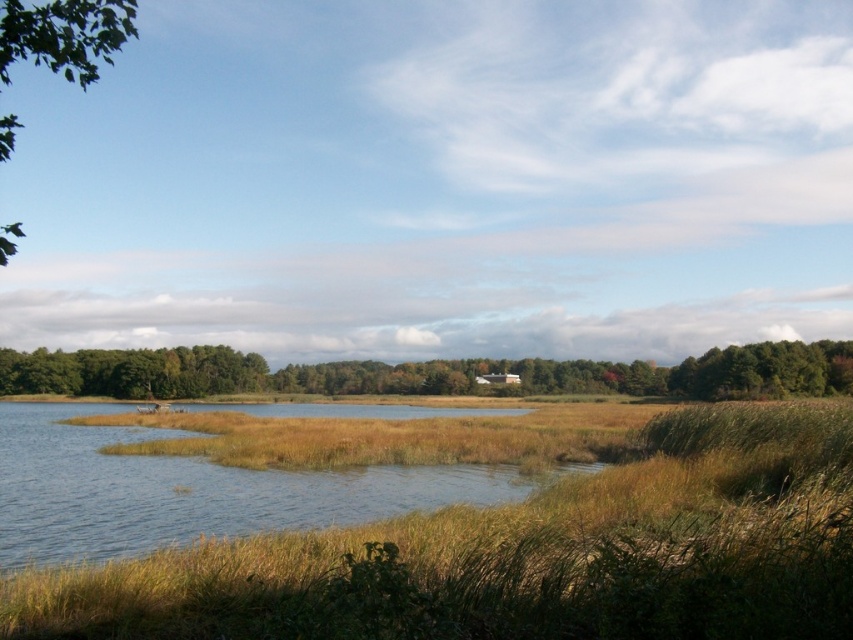
You are standing at the edge of the water in the scene. If you want to walk towards the green leafy trees at center, in which general direction should you head?

The green leafy trees at center are located at the point with coordinates 0.584 on the x axis and 0.503 on the y axis. Since you are at the edge of the water, you should walk towards the center of the image to reach them.

You are a hiker who wants to cross from the brown grass at center to the green leafy trees at center. The path between them is straight. Your backpack has a 100 meter rope. Can you safely cross the distance using the rope?

The distance between the brown grass at center and the green leafy trees at center is 104.42 meters. Since the rope is only 100 meters long, it is not long enough to safely cross the 104.42 meter gap. You would need a longer rope or an alternative method to bridge the distance.

You are an environmental scientist analyzing the image. You need to determine which object has a smaller width between the brown grass at center and the green leafy trees at center. Based on the scene, what is your conclusion?

The brown grass at center is thinner than the green leafy trees at center, so the brown grass at center has a smaller width.